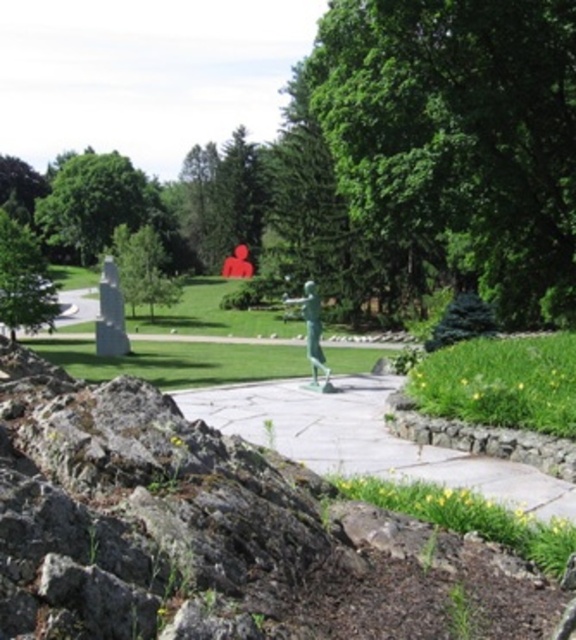
Looking at this image, is green leafy tree at upper left shorter than green leafy tree at left?

In fact, green leafy tree at upper left may be taller than green leafy tree at left.

Does green leafy tree at upper left appear on the left side of green leafy tree at left?

Indeed, green leafy tree at upper left is positioned on the left side of green leafy tree at left.

Which is behind, point (43, 205) or point (17, 323)?

Point (43, 205)

Where is `green leafy tree at upper left`? This screenshot has height=640, width=576. green leafy tree at upper left is located at coordinates (94, 204).

Is green leafy tree at center to the right of green patinated bronze statue at center from the viewer's perspective?

Correct, you'll find green leafy tree at center to the right of green patinated bronze statue at center.

Is green leafy tree at center bigger than green patinated bronze statue at center?

Indeed, green leafy tree at center has a larger size compared to green patinated bronze statue at center.

The image size is (576, 640). What do you see at coordinates (457, 138) in the screenshot?
I see `green leafy tree at center` at bounding box center [457, 138].

Identify the location of green leafy tree at center. This screenshot has width=576, height=640. (457, 138).

How much distance is there between green leafy tree at left and green patinated bronze statue at center?

green leafy tree at left is 84.89 feet from green patinated bronze statue at center.

Between green leafy tree at left and green patinated bronze statue at center, which one has more height?

Standing taller between the two is green leafy tree at left.

Between point (2, 252) and point (316, 312), which one is positioned behind?

Positioned behind is point (2, 252).

Where is `green leafy tree at left`? green leafy tree at left is located at coordinates (24, 280).